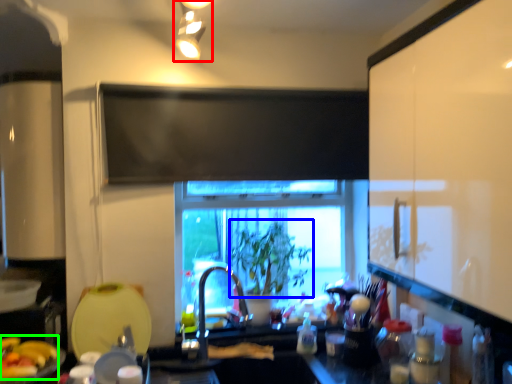
Question: Estimate the real-world distances between objects in this image. Which object is closer to light fixture (highlighted by a red box), plant (highlighted by a blue box) or food (highlighted by a green box)?

Choices:
 (A) plant
 (B) food

Answer: (A)